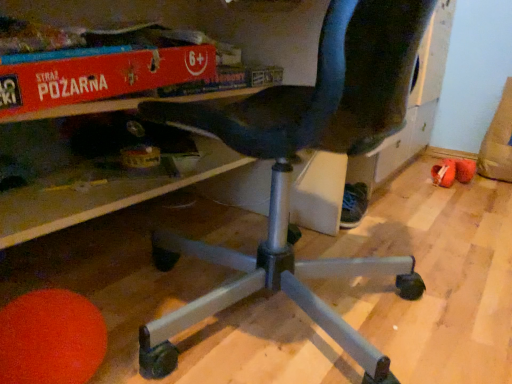
Identify the location of vacant space in between brown suede bean bag at lower right and black fabric shoe at lower center, which ranks as the first footwear in front-to-back order. (425, 201).